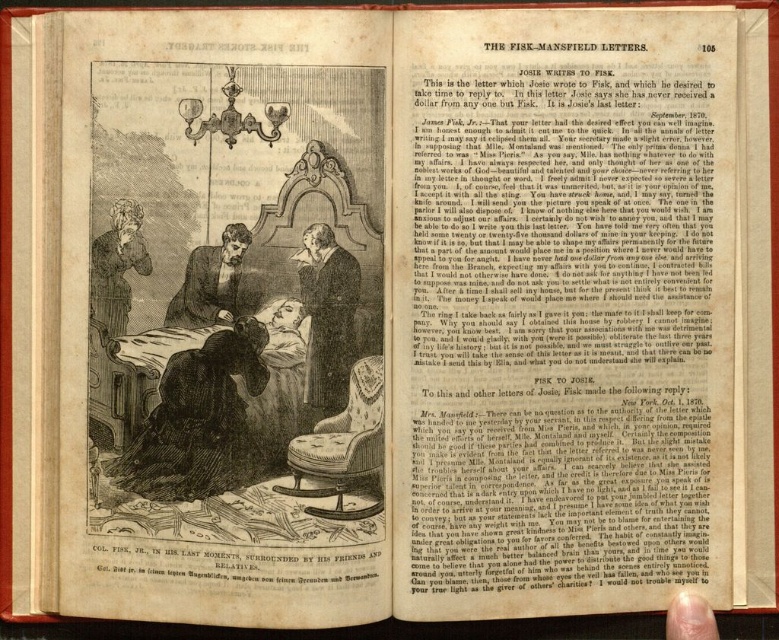
Is smooth black coat at center smaller than smooth pinkish skin at lower right?

Yes.

Is point (323, 356) closer to camera compared to point (672, 602)?

Yes, it is.

Where is `smooth black coat at center`? The height and width of the screenshot is (640, 779). smooth black coat at center is located at coordinates (326, 316).

Does dark brown leather jacket at center appear on the left side of smooth pinkish skin at lower right?

Indeed, dark brown leather jacket at center is positioned on the left side of smooth pinkish skin at lower right.

Is point (196, 316) positioned after point (679, 634)?

Yes, point (196, 316) is farther from viewer.

This screenshot has height=640, width=779. What are the coordinates of `dark brown leather jacket at center` in the screenshot? It's located at (210, 284).

Can you confirm if smooth black coat at center is thinner than dark brown leather jacket at center?

Yes.

Who is lower down, smooth black coat at center or dark brown leather jacket at center?

smooth black coat at center

Who is more distant from viewer, (337, 308) or (194, 308)?

Positioned behind is point (194, 308).

Find the location of `smooth black coat at center`. smooth black coat at center is located at coordinates (326, 316).